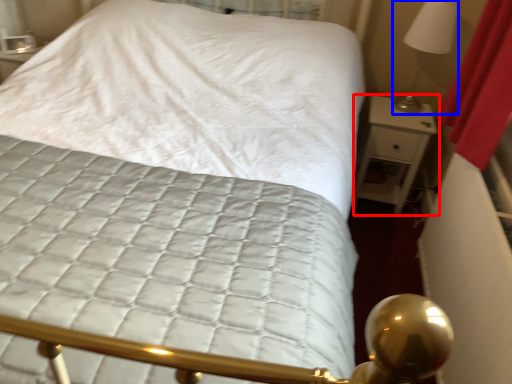
Question: Which of the following is the closest to the observer, nightstand (highlighted by a red box) or bedside lamp (highlighted by a blue box)?

Choices:
 (A) nightstand
 (B) bedside lamp

Answer: (B)